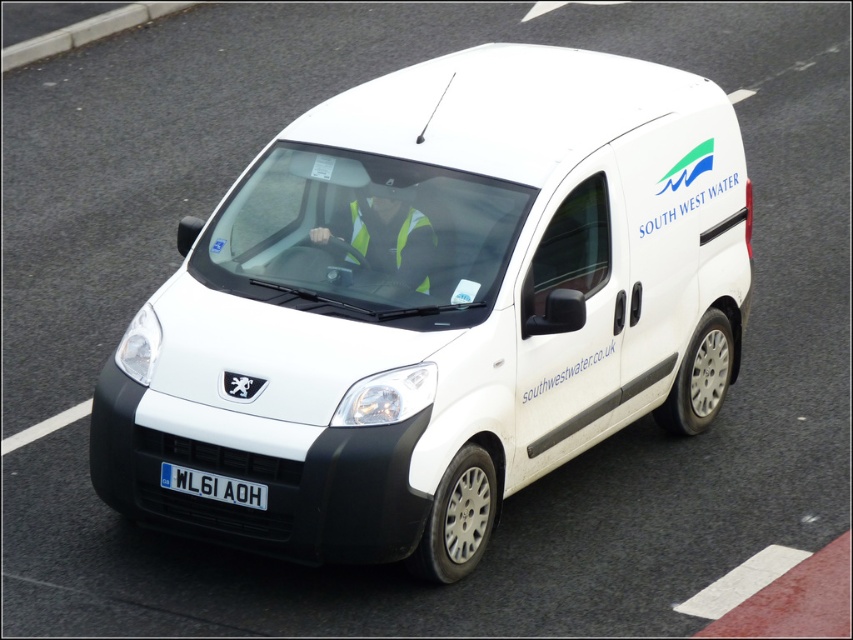
Can you confirm if white matte van at center is positioned below reflective yellow vest at center?

Correct, white matte van at center is located below reflective yellow vest at center.

Can you confirm if white matte van at center is positioned above reflective yellow vest at center?

Actually, white matte van at center is below reflective yellow vest at center.

Who is more distant from viewer, (573,52) or (422,289)?

The point (573,52) is more distant.

Find the location of a particular element. This screenshot has height=640, width=853. white matte van at center is located at coordinates (438, 307).

Is point (379, 268) farther from camera compared to point (252, 492)?

Yes, it is.

Measure the distance between point (415,180) and camera.

Point (415,180) and camera are 22.13 feet apart from each other.

Which is in front, point (323, 230) or point (218, 481)?

Point (218, 481) is in front.

Image resolution: width=853 pixels, height=640 pixels. In order to click on reflective yellow vest at center in this screenshot , I will do `click(386, 237)`.

Image resolution: width=853 pixels, height=640 pixels. What do you see at coordinates (438, 307) in the screenshot?
I see `white matte van at center` at bounding box center [438, 307].

Is point (183, 284) positioned before point (257, 508)?

No, (183, 284) is behind (257, 508).

Locate an element on the screen. This screenshot has height=640, width=853. white matte van at center is located at coordinates (438, 307).